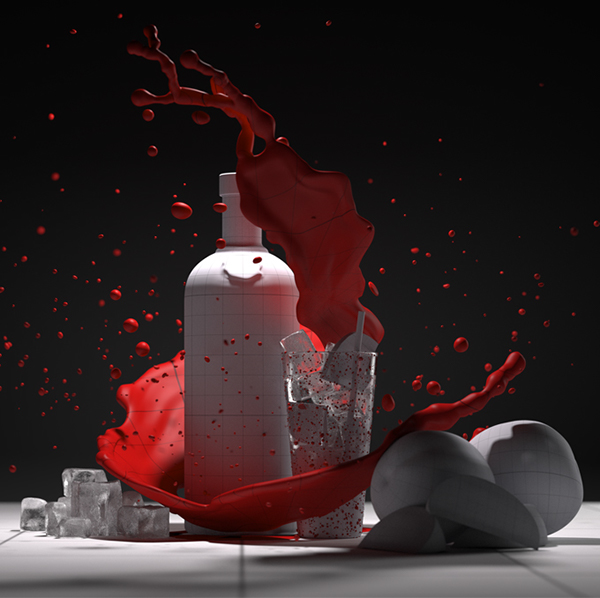
Identify the location of surface. (378, 581).